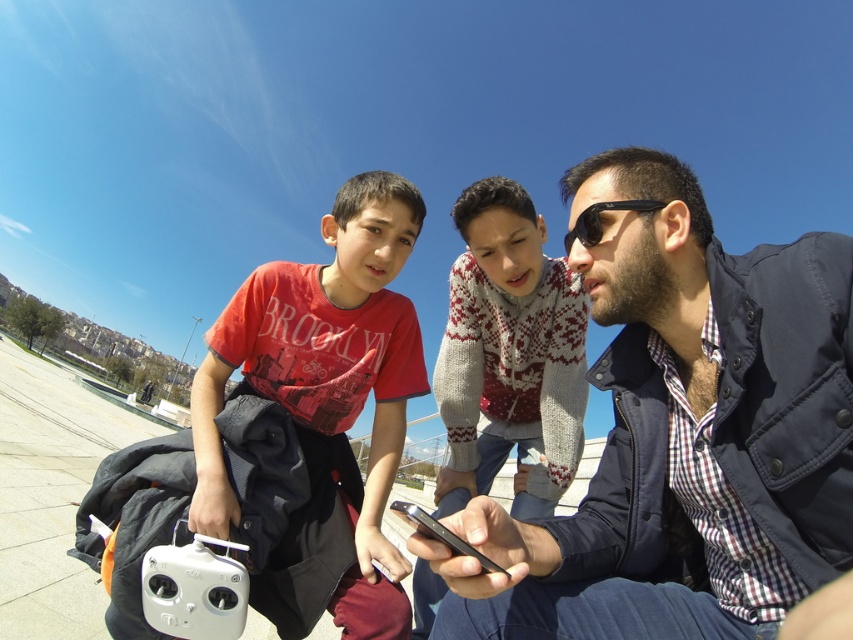
Question: Which object is the farthest from the black matte smartphone at center?

Choices:
 (A) knitted sweater at center
 (B) matte red t-shirt at center
 (C) black plastic sunglasses at center
 (D) dark blue jacket at center

Answer: (A)

Question: Which object is closer to the camera taking this photo?

Choices:
 (A) dark blue jacket at center
 (B) black matte smartphone at center
 (C) black plastic sunglasses at center
 (D) knitted sweater at center

Answer: (B)

Question: Is dark blue jacket at center to the left of matte red t-shirt at center from the viewer's perspective?

Choices:
 (A) no
 (B) yes

Answer: (A)

Question: Can you confirm if dark blue jacket at center is positioned above knitted sweater at center?

Choices:
 (A) no
 (B) yes

Answer: (B)

Question: Based on their relative distances, which object is farther from the black plastic sunglasses at center?

Choices:
 (A) dark blue jacket at center
 (B) matte red t-shirt at center
 (C) knitted sweater at center
 (D) black matte smartphone at center

Answer: (C)

Question: Can you confirm if knitted sweater at center is bigger than black matte smartphone at center?

Choices:
 (A) no
 (B) yes

Answer: (A)